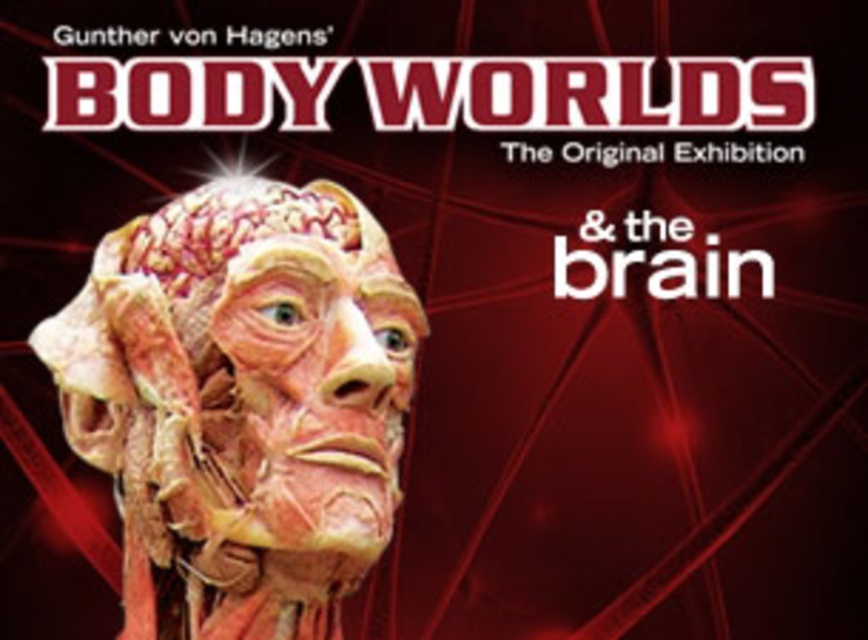
Question: Is smooth flesh-colored head at center below pinkish flesh-colored muscle at center?

Choices:
 (A) no
 (B) yes

Answer: (A)

Question: Which object appears farthest from the camera in this image?

Choices:
 (A) smooth flesh-colored head at center
 (B) pinkish flesh-colored muscle at center

Answer: (A)

Question: Among these objects, which one is farthest from the camera?

Choices:
 (A) smooth flesh-colored head at center
 (B) pinkish flesh-colored muscle at center

Answer: (A)

Question: Is smooth flesh-colored head at center above pinkish flesh-colored muscle at center?

Choices:
 (A) no
 (B) yes

Answer: (B)

Question: Observing the image, what is the correct spatial positioning of smooth flesh-colored head at center in reference to pinkish flesh-colored muscle at center?

Choices:
 (A) right
 (B) left

Answer: (A)